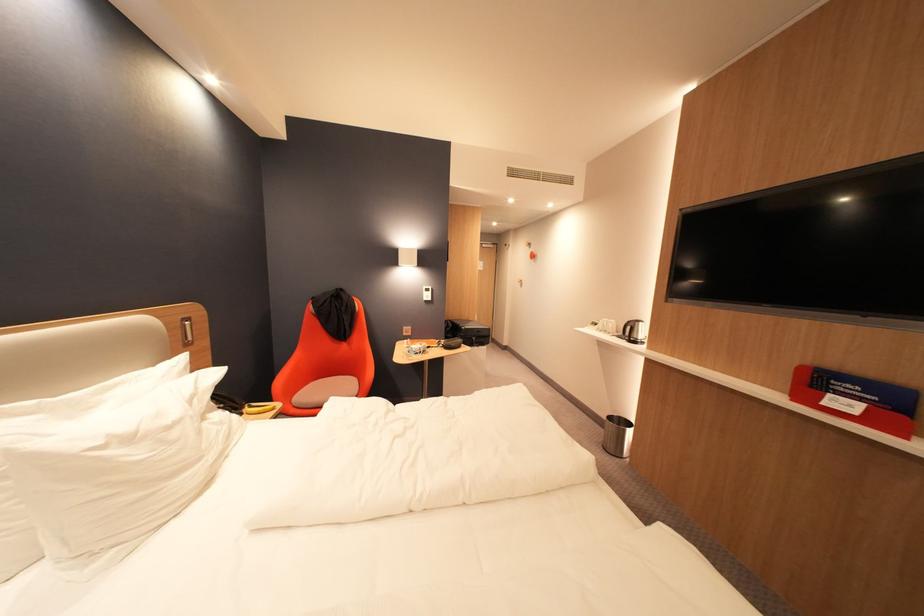
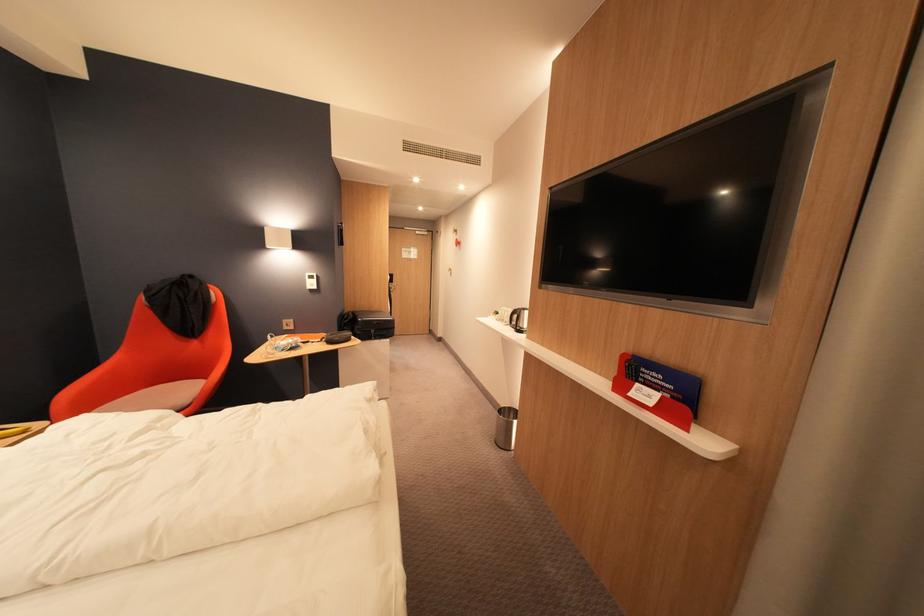
The point at (598,416) is marked in the first image. Where is the corresponding point in the second image?

(504, 408)